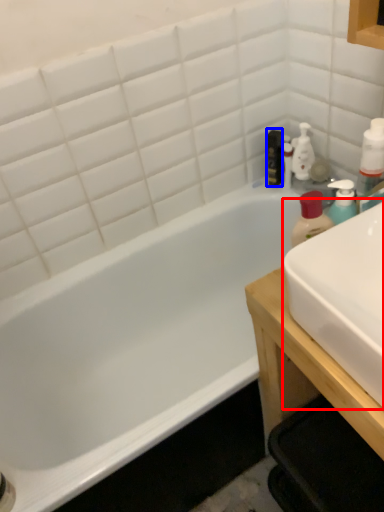
Question: Which point is closer to the camera, sink (highlighted by a red box) or mouthwash (highlighted by a blue box)?

Choices:
 (A) sink
 (B) mouthwash

Answer: (A)